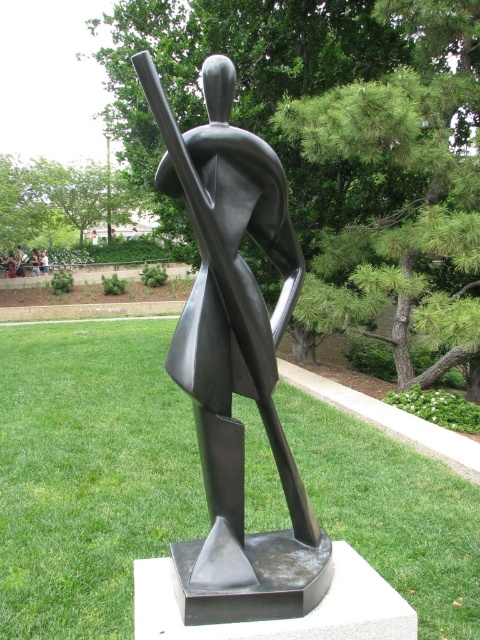
Locate an element on the screen. The height and width of the screenshot is (640, 480). polished bronze statue at center is located at coordinates (235, 358).

Does metallic silver statue at center have a greater width compared to matte black statue at center?

Indeed, metallic silver statue at center has a greater width compared to matte black statue at center.

Is point (32, 268) farther from camera compared to point (41, 256)?

No, (32, 268) is in front of (41, 256).

You are a GUI agent. You are given a task and a screenshot of the screen. Output one action in this format:
    pyautogui.click(x=<x>, y=<y>)
    Task: Click on the metallic silver statue at center
    
    Given the screenshot: What is the action you would take?
    pyautogui.click(x=36, y=262)

Is polished bronze statue at center further to camera compared to matte black statue at center?

No.

Can you confirm if polished bronze statue at center is smaller than matte black statue at center?

Incorrect, polished bronze statue at center is not smaller in size than matte black statue at center.

Where is `polished bronze statue at center`? The width and height of the screenshot is (480, 640). polished bronze statue at center is located at coordinates (235, 358).